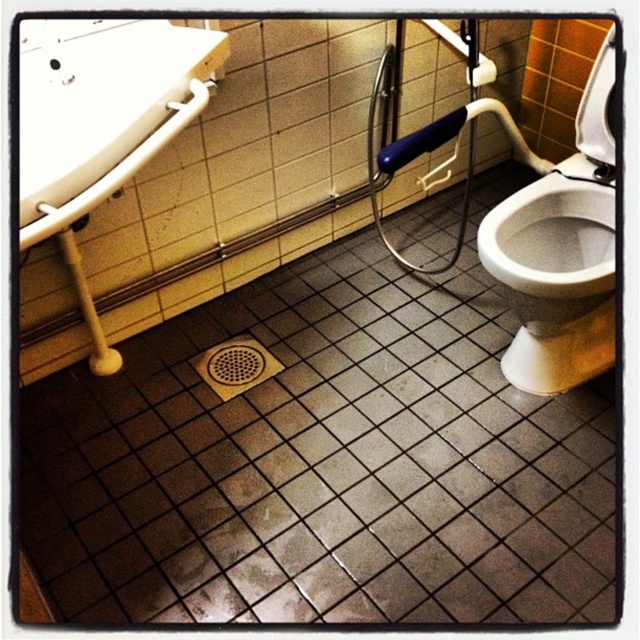
Question: Does black tile at center have a larger size compared to white glossy sink at upper left?

Choices:
 (A) yes
 (B) no

Answer: (A)

Question: Which object is positioned closest to the black tile at center?

Choices:
 (A) white glossy sink at upper left
 (B) white glossy toilet bowl at right

Answer: (B)

Question: Which point is farther to the camera?

Choices:
 (A) white glossy toilet bowl at right
 (B) brown textured drain at center

Answer: (B)

Question: Can you confirm if black tile at center is positioned above brown textured drain at center?

Choices:
 (A) no
 (B) yes

Answer: (A)

Question: Which object is positioned closest to the brown textured drain at center?

Choices:
 (A) white glossy toilet bowl at right
 (B) black tile at center

Answer: (B)

Question: Can you confirm if white glossy sink at upper left is wider than brown textured drain at center?

Choices:
 (A) yes
 (B) no

Answer: (A)